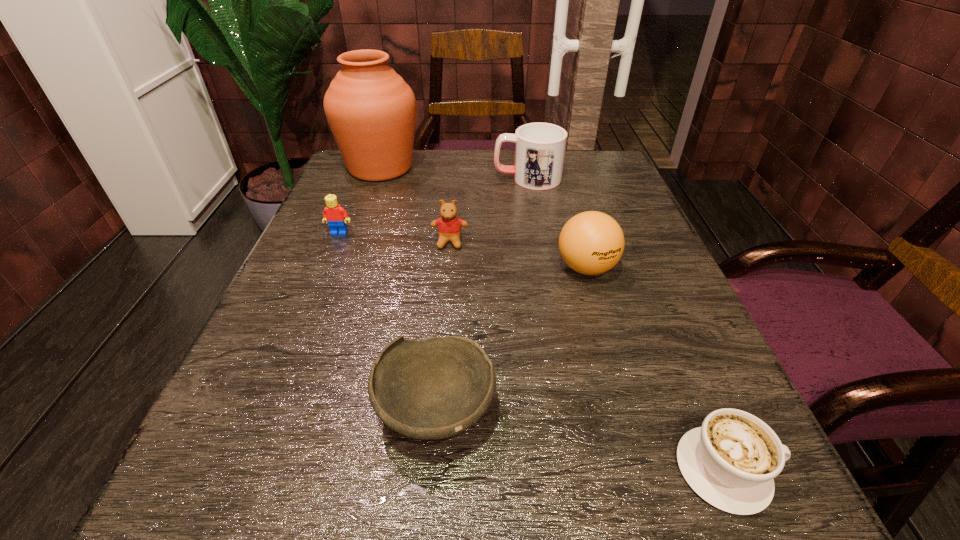
Locate an element on the screen. vacant space that's between the cappuccino and the ping-pong ball is located at coordinates (656, 369).

Locate an element on the screen. free space between the ping-pong ball and the bowl is located at coordinates pyautogui.click(x=511, y=339).

The width and height of the screenshot is (960, 540). What are the coordinates of `the fourth closest object to the teddy bear` in the screenshot? It's located at (371, 111).

Find the location of a particular element. The height and width of the screenshot is (540, 960). object that is the third closest to the urn is located at coordinates (449, 226).

Locate an element on the screen. The image size is (960, 540). vacant space that satisfies the following two spatial constraints: 1. on the face of the Lego; 2. on the right side of the bowl is located at coordinates (266, 410).